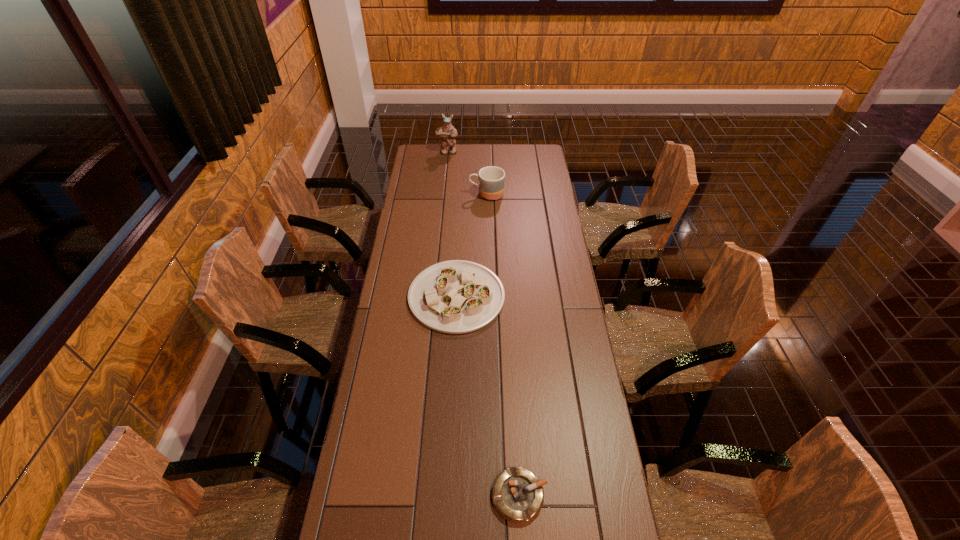
This screenshot has width=960, height=540. I want to click on figurine, so click(x=448, y=133).

At what (x,y) coordinates should I click in order to perform the action: click on the tallest object. Please return your answer as a coordinate pair (x, y). This screenshot has width=960, height=540. Looking at the image, I should click on (448, 133).

Where is `the third shortest object`? the third shortest object is located at coordinates (491, 179).

The image size is (960, 540). Find the location of `mug`. mug is located at coordinates (491, 179).

Identify the location of platter. The height and width of the screenshot is (540, 960). (456, 296).

Where is `the second shortest object`? This screenshot has height=540, width=960. the second shortest object is located at coordinates (456, 296).

Locate an element on the screen. Image resolution: width=960 pixels, height=540 pixels. ashtray is located at coordinates (517, 494).

Where is `the shortest object`? the shortest object is located at coordinates (517, 494).

Locate an element on the screen. vacant position located on the front-facing side of the figurine is located at coordinates (445, 171).

Identify the location of vacant space located 0.060m on the side with the handle of the mug. Image resolution: width=960 pixels, height=540 pixels. pos(457,194).